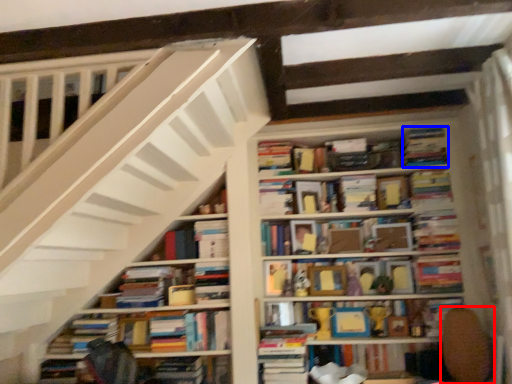
Question: Among these objects, which one is farthest to the camera, swivel chair (highlighted by a red box) or book (highlighted by a blue box)?

Choices:
 (A) swivel chair
 (B) book

Answer: (B)